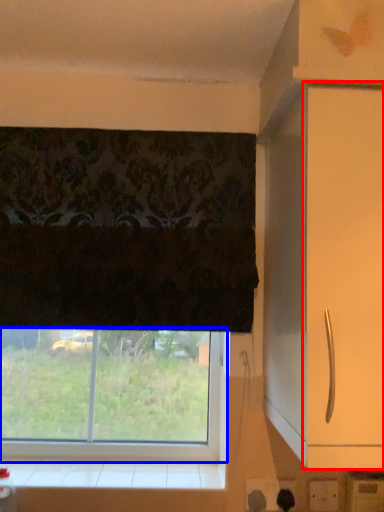
Question: Which point is closer to the camera, screen door (highlighted by a red box) or window (highlighted by a blue box)?

Choices:
 (A) screen door
 (B) window

Answer: (A)